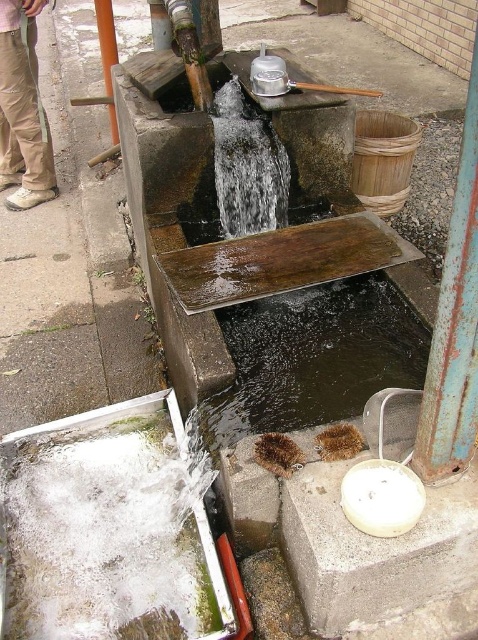
Which of these two, brown textured water at center or khaki pants at left, stands taller?

khaki pants at left

Where is `brown textured water at center`? This screenshot has height=640, width=478. brown textured water at center is located at coordinates (312, 356).

Who is more forward, (325, 378) or (40, 148)?

Point (325, 378) is in front.

This screenshot has height=640, width=478. I want to click on brown textured water at center, so click(x=312, y=356).

Who is positioned more to the right, rusty metal pole at right or khaki pants at left?

From the viewer's perspective, rusty metal pole at right appears more on the right side.

Is point (448, 397) farther from camera compared to point (21, 76)?

No, (448, 397) is closer to viewer.

Where is `rusty metal pole at right`? rusty metal pole at right is located at coordinates [x=455, y=323].

Is point (205, 404) positioned after point (466, 232)?

Yes.

Is point (336, 388) behind point (416, 445)?

Yes, it is behind point (416, 445).

At what (x,y) coordinates should I click in order to perform the action: click on brown textured water at center. Please return your answer as a coordinate pair (x, y). The image size is (478, 640). Looking at the image, I should click on (312, 356).